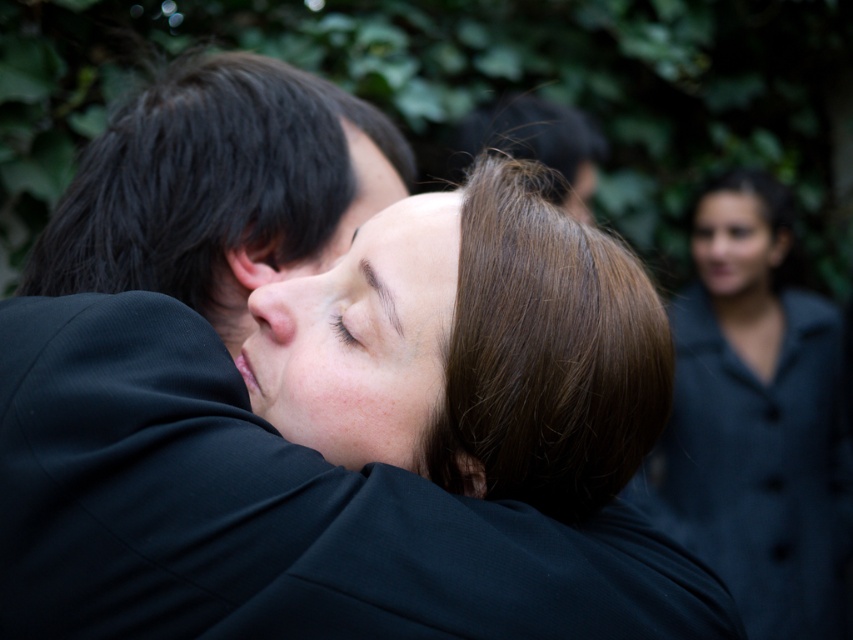
Looking at this image, is smooth skin forehead at center thinner than pink flesh-toned nose at center?

Incorrect, smooth skin forehead at center's width is not less than pink flesh-toned nose at center's.

Does point (401, 253) lie behind point (283, 304)?

That is False.

Which is in front, point (363, 280) or point (258, 321)?

Point (363, 280)

In order to click on smooth skin forehead at center in this screenshot , I will do `click(408, 246)`.

Does point (817, 388) come farther from viewer compared to point (427, 360)?

Yes, point (817, 388) is farther from viewer.

Is matte black coat at upper right to the right of smooth skin face at center from the viewer's perspective?

Yes, matte black coat at upper right is to the right of smooth skin face at center.

Locate an element on the screen. matte black coat at upper right is located at coordinates [756, 420].

Does point (708, 272) come closer to viewer compared to point (289, 324)?

No, (708, 272) is further to viewer.

What do you see at coordinates (735, 248) in the screenshot? I see `smooth skin face at upper right` at bounding box center [735, 248].

Where is `smooth skin face at upper right`? This screenshot has width=853, height=640. smooth skin face at upper right is located at coordinates (735, 248).

What are the coordinates of `smooth skin face at upper right` in the screenshot? It's located at (735, 248).